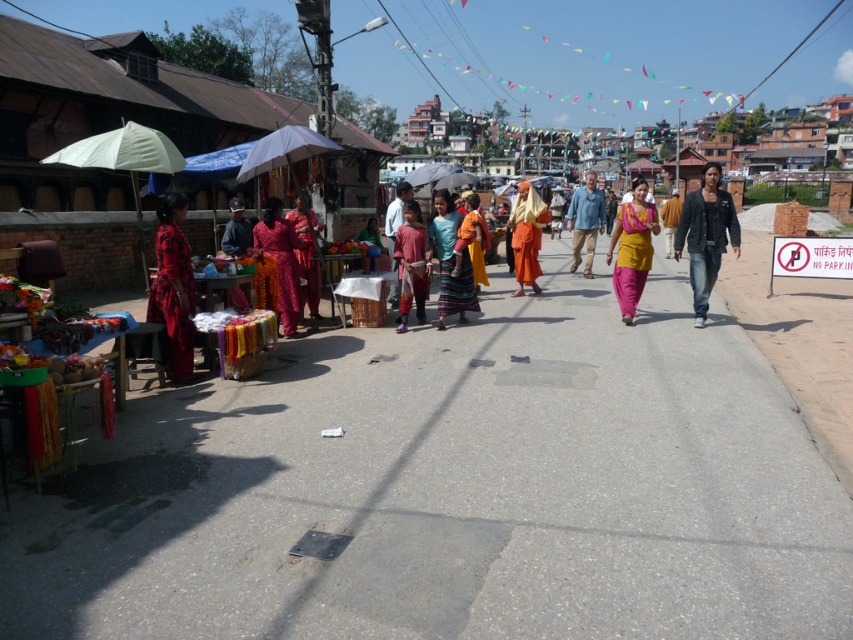
You are a customer in the market and want to buy the shiny orange dress at center. You see the dark blue denim jeans at right displayed next to it. Which item is closer to the right side of the market street?

The dark blue denim jeans at right is positioned on the right side of the shiny orange dress at center, so it is closer to the right side of the market street.

You are a customer looking to buy an orange dress and an umbrella. You see the matte orange dress at center and the white fabric umbrella at center in the market. Which item is positioned closer to the left side of the street?

The matte orange dress at center is positioned to the left of the white fabric umbrella at center, so it is closer to the left side of the street.